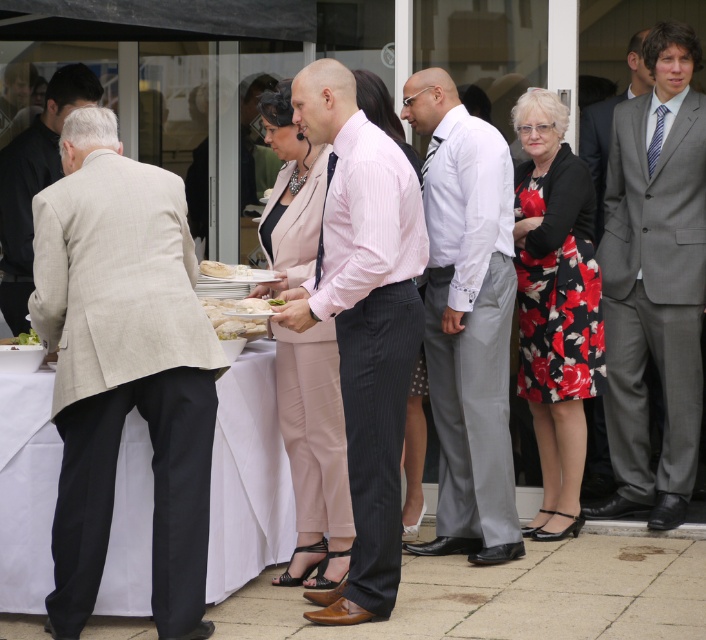
Does pink striped shirt at center have a larger size compared to floral dress at center?

Correct, pink striped shirt at center is larger in size than floral dress at center.

Is point (371, 545) positioned behind point (526, 204)?

No, it is not.

At what (x,y) coordinates should I click in order to perform the action: click on pink striped shirt at center. Please return your answer as a coordinate pair (x, y). Image resolution: width=706 pixels, height=640 pixels. Looking at the image, I should click on (364, 321).

Is point (251, 467) closer to viewer compared to point (32, 340)?

No.

Does white linen table at lower left have a lesser width compared to green leafy salad at center?

No.

Which is in front, point (245, 371) or point (8, 339)?

Point (8, 339) is in front.

Locate an element on the screen. white linen table at lower left is located at coordinates (246, 476).

Which is above, gray suit at right or green leafy salad at center?

gray suit at right

Does gray suit at right appear on the left side of green leafy salad at center?

No, gray suit at right is not to the left of green leafy salad at center.

Between point (642, 353) and point (44, 342), which one is positioned behind?

Positioned behind is point (642, 353).

You are a GUI agent. You are given a task and a screenshot of the screen. Output one action in this format:
    pyautogui.click(x=<x>, y=<y>)
    Task: Click on the gray suit at right
    This screenshot has width=706, height=640.
    Given the screenshot: What is the action you would take?
    pyautogui.click(x=654, y=280)